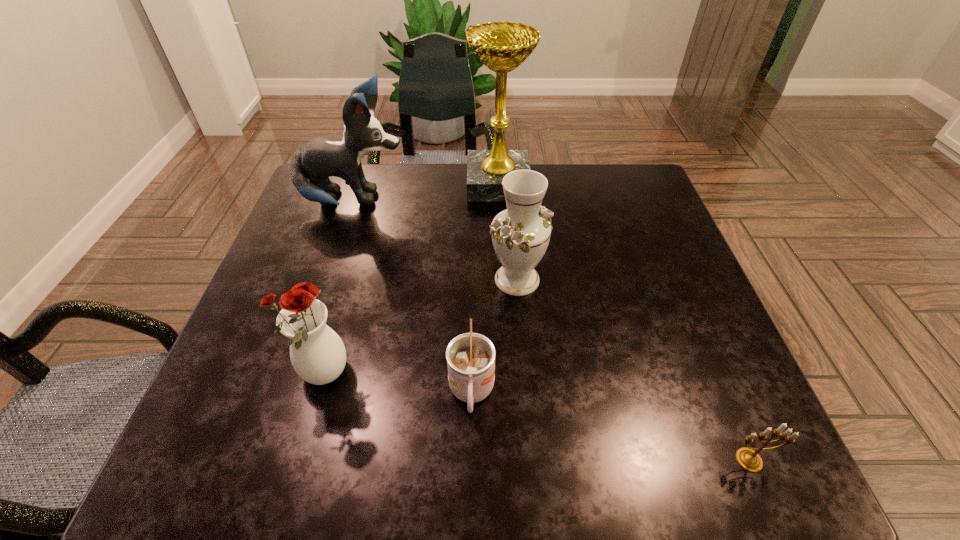
Locate an element on the screen. This screenshot has height=540, width=960. award is located at coordinates (502, 46).

Image resolution: width=960 pixels, height=540 pixels. I want to click on the second tallest object, so [313, 163].

Identify the location of the right vase. (520, 234).

This screenshot has width=960, height=540. What are the coordinates of `the fourth nearest object` in the screenshot? It's located at pos(520,234).

Image resolution: width=960 pixels, height=540 pixels. In order to click on the nearer vase in this screenshot , I will do `click(317, 353)`.

The height and width of the screenshot is (540, 960). What are the coordinates of `cup` in the screenshot? It's located at (470, 357).

This screenshot has width=960, height=540. Identify the location of the nearest object. (748, 459).

Locate an element on the screen. The height and width of the screenshot is (540, 960). the rightmost object is located at coordinates (748, 459).

The height and width of the screenshot is (540, 960). I want to click on free space located 0.190m on the front-facing side of the award, so click(x=401, y=184).

Image resolution: width=960 pixels, height=540 pixels. Find the location of `vacant space located on the front-facing side of the award`. vacant space located on the front-facing side of the award is located at coordinates (355, 184).